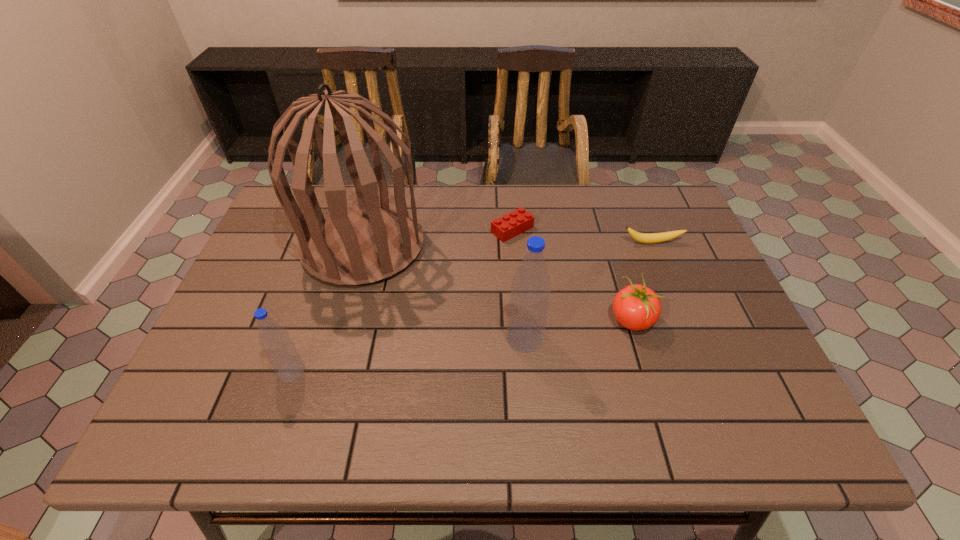
Please point a free position for a water bottle on the right. Please provide its 2D coordinates. Your answer should be formatted as a tuple, i.e. [(x, y)], where the tuple contains the x and y coordinates of a point satisfying the conditions above.

[(732, 309)]